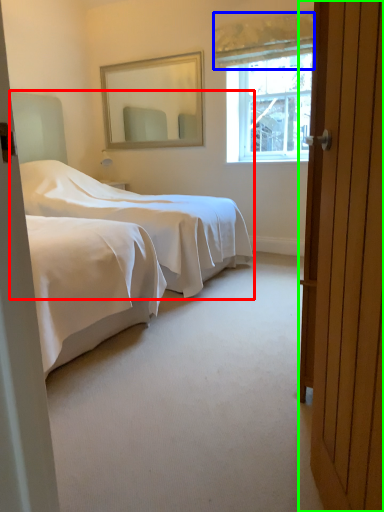
Question: Which object is positioned farthest from bed (highlighted by a red box)? Select from curtain (highlighted by a blue box) and door (highlighted by a green box).

Choices:
 (A) curtain
 (B) door

Answer: (B)